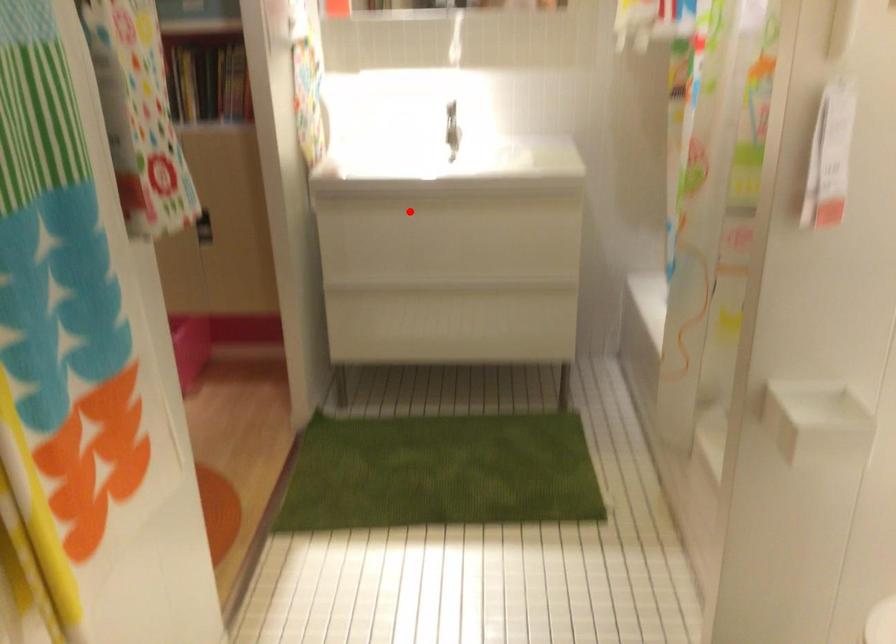
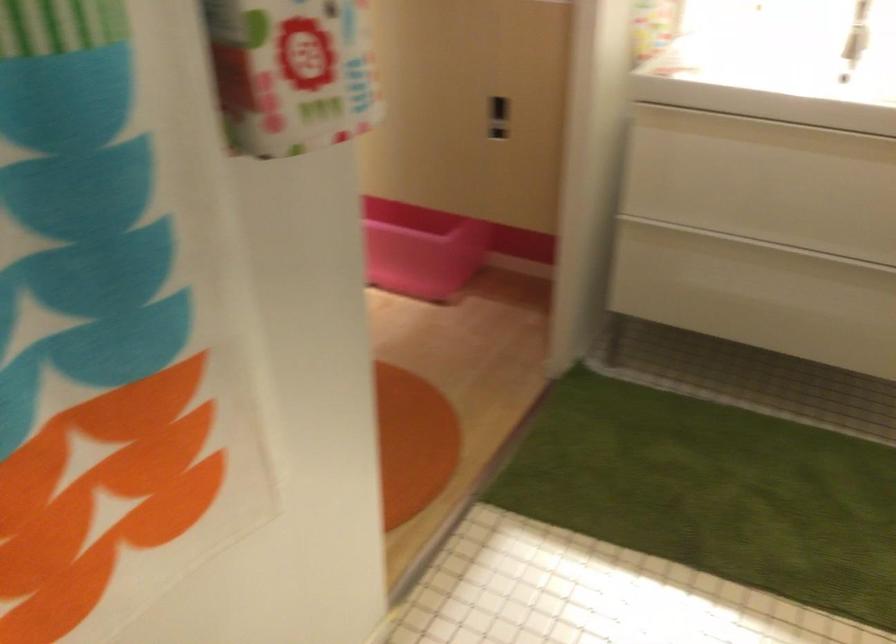
Question: I am providing you with two images of the same scene from different viewpoints. Image1 has a red point marked. In image2, the corresponding 3D location appears at what relative position? Reply with the corresponding letter.

Choices:
 (A) Closer
 (B) Farther

Answer: (A)